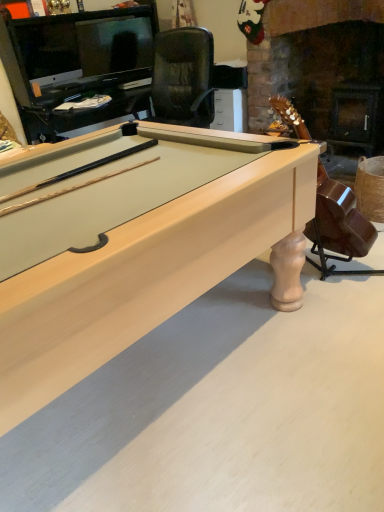
Question: Is matte brown guitar at center-right spatially inside light wood billiard table at center, or outside of it?

Choices:
 (A) inside
 (B) outside

Answer: (B)

Question: Does point (319, 181) appear closer or farther from the camera than point (110, 180)?

Choices:
 (A) farther
 (B) closer

Answer: (A)

Question: Considering their positions, is matte brown guitar at center-right located in front of or behind light wood billiard table at center?

Choices:
 (A) front
 (B) behind

Answer: (B)

Question: In terms of height, does light wood billiard table at center look taller or shorter compared to matte brown guitar at center-right?

Choices:
 (A) short
 (B) tall

Answer: (A)

Question: From a real-world perspective, is light wood billiard table at center physically located above or below matte brown guitar at center-right?

Choices:
 (A) above
 (B) below

Answer: (B)

Question: From the image's perspective, is light wood billiard table at center above or below matte brown guitar at center-right?

Choices:
 (A) below
 (B) above

Answer: (A)

Question: Relative to matte brown guitar at center-right, is light wood billiard table at center in front or behind?

Choices:
 (A) front
 (B) behind

Answer: (A)